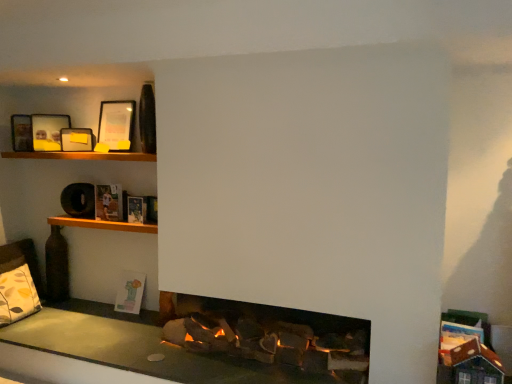
Question: From a real-world perspective, is patterned fabric pillow at lower left positioned under wooden shelf at upper left, marked as the 1th shelf in a bottom-to-top arrangement, based on gravity?

Choices:
 (A) no
 (B) yes

Answer: (B)

Question: Is patterned fabric pillow at lower left positioned in front of wooden shelf at upper left, marked as the 1th shelf in a bottom-to-top arrangement?

Choices:
 (A) no
 (B) yes

Answer: (A)

Question: Can you confirm if patterned fabric pillow at lower left is wider than wooden shelf at upper left, acting as the second shelf starting from the top?

Choices:
 (A) no
 (B) yes

Answer: (A)

Question: Considering the relative sizes of patterned fabric pillow at lower left and wooden shelf at upper left, marked as the 1th shelf in a bottom-to-top arrangement, in the image provided, is patterned fabric pillow at lower left smaller than wooden shelf at upper left, marked as the 1th shelf in a bottom-to-top arrangement,?

Choices:
 (A) no
 (B) yes

Answer: (A)

Question: Considering the relative sizes of patterned fabric pillow at lower left and wooden shelf at upper left, acting as the second shelf starting from the top, in the image provided, is patterned fabric pillow at lower left thinner than wooden shelf at upper left, acting as the second shelf starting from the top,?

Choices:
 (A) yes
 (B) no

Answer: (A)

Question: From the image's perspective, is patterned fabric pillow at lower left located beneath wooden shelf at upper left, acting as the second shelf starting from the top?

Choices:
 (A) yes
 (B) no

Answer: (A)

Question: Can you see matte black picture frame at upper left, which appears as the third picture frame when viewed from the right, touching wooden shelf at upper left, acting as the second shelf starting from the top?

Choices:
 (A) no
 (B) yes

Answer: (A)

Question: Is matte black picture frame at upper left, which appears as the third picture frame when viewed from the right, positioned with its back to wooden shelf at upper left, acting as the second shelf starting from the top?

Choices:
 (A) yes
 (B) no

Answer: (B)

Question: Considering the relative sizes of matte black picture frame at upper left, which appears as the third picture frame when viewed from the right, and wooden shelf at upper left, acting as the second shelf starting from the top, in the image provided, is matte black picture frame at upper left, which appears as the third picture frame when viewed from the right, wider than wooden shelf at upper left, acting as the second shelf starting from the top,?

Choices:
 (A) yes
 (B) no

Answer: (B)

Question: From the image's perspective, is matte black picture frame at upper left, which appears as the third picture frame when viewed from the right, below wooden shelf at upper left, marked as the 1th shelf in a bottom-to-top arrangement?

Choices:
 (A) yes
 (B) no

Answer: (B)

Question: Does matte black picture frame at upper left, which appears as the third picture frame when viewed from the right, have a larger size compared to wooden shelf at upper left, acting as the second shelf starting from the top?

Choices:
 (A) no
 (B) yes

Answer: (A)

Question: Is matte black picture frame at upper left, acting as the first picture frame starting from the left, closer to the viewer compared to wooden shelf at upper left, marked as the 1th shelf in a bottom-to-top arrangement?

Choices:
 (A) no
 (B) yes

Answer: (A)

Question: Is wooden shelf at upper left, acting as the second shelf starting from the top, outside matte black picture frame at upper left, which appears as the third picture frame when viewed from the right?

Choices:
 (A) no
 (B) yes

Answer: (B)